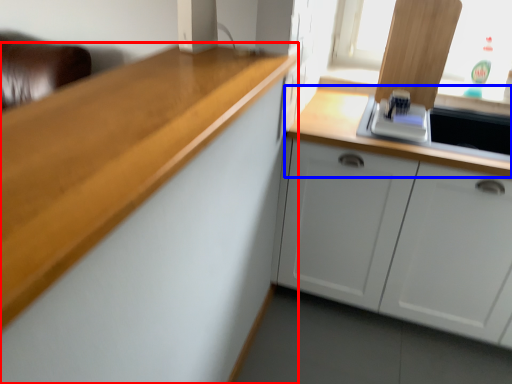
Question: Which object appears closest to the camera in this image, cabinetry (highlighted by a red box) or countertop (highlighted by a blue box)?

Choices:
 (A) cabinetry
 (B) countertop

Answer: (A)